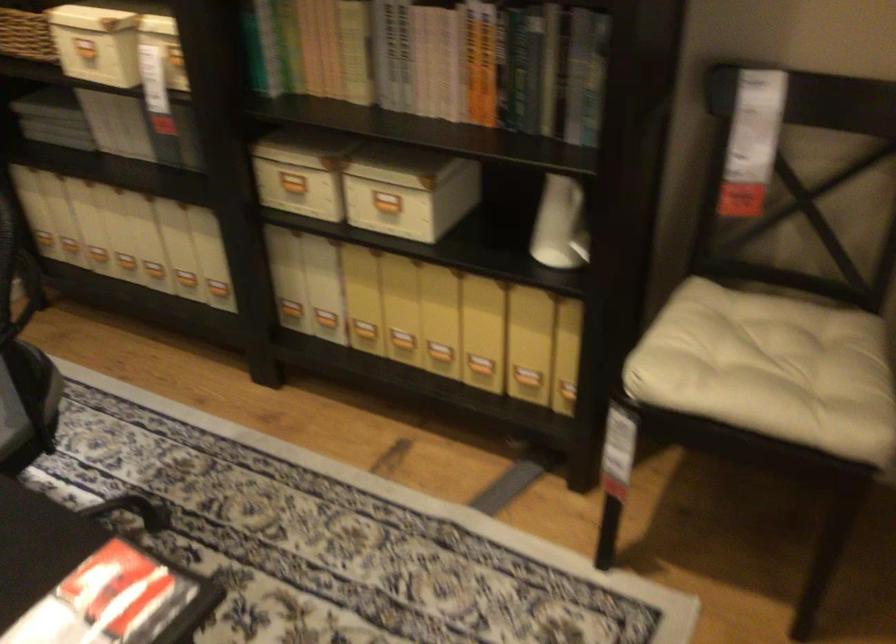
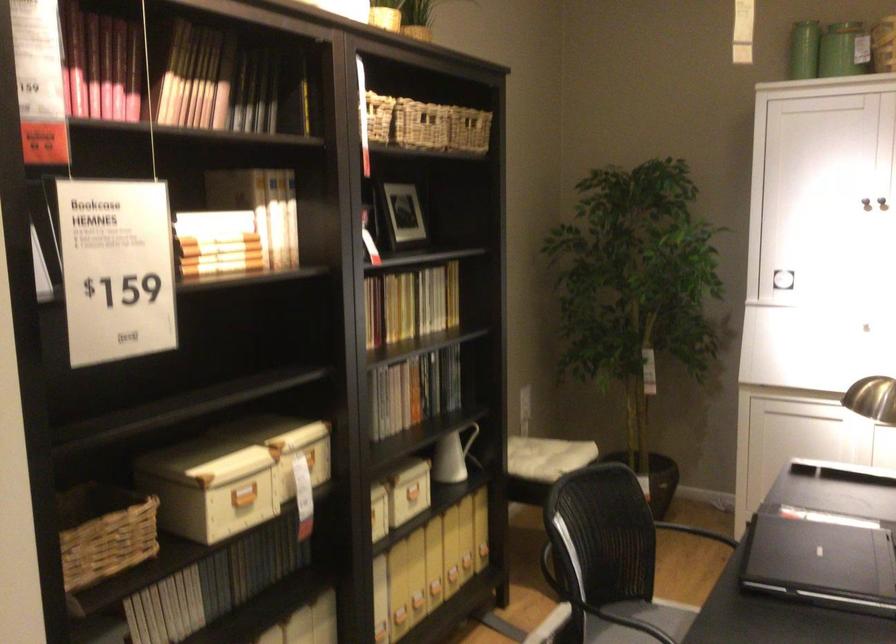
Locate, in the second image, the point that corresponds to (615,227) in the first image.

(474, 444)